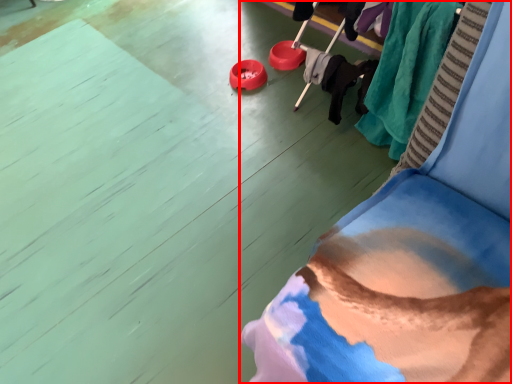
Question: From the image's perspective, where is furniture (annotated by the red box) located relative to clothing?

Choices:
 (A) below
 (B) above

Answer: (B)